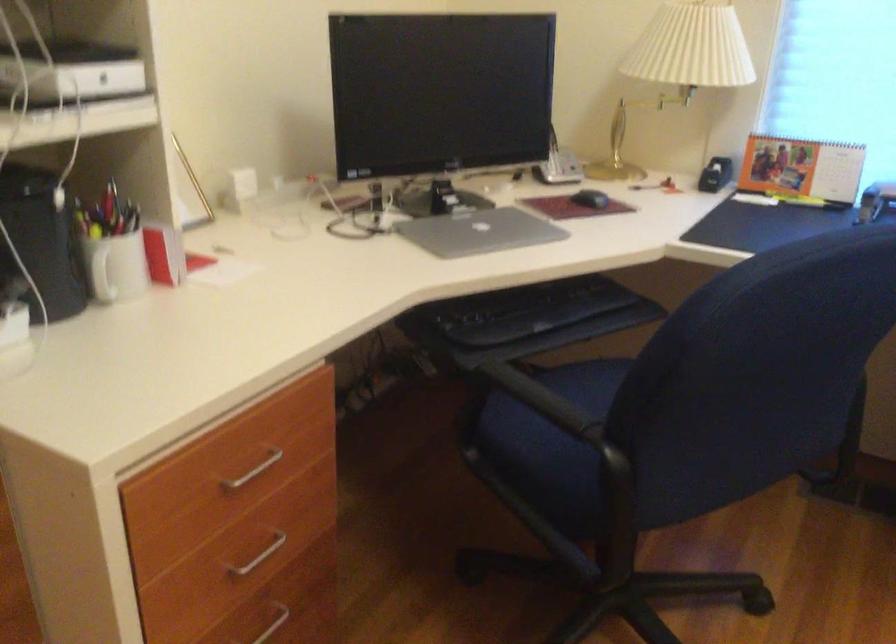
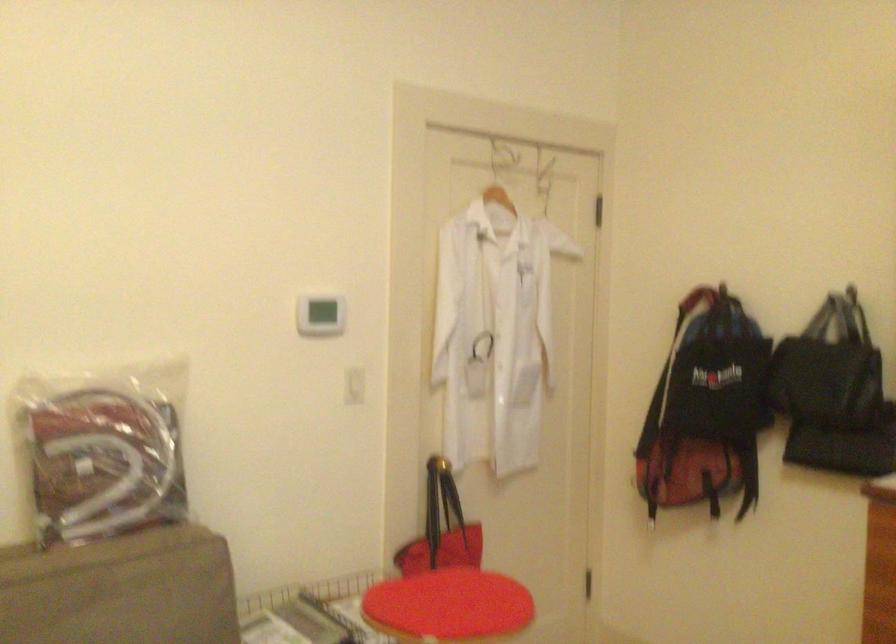
Question: Based on the continuous images, in which direction is the camera rotating? Reply with the corresponding letter.

Choices:
 (A) Left
 (B) Right
 (C) Up
 (D) Down

Answer: (A)